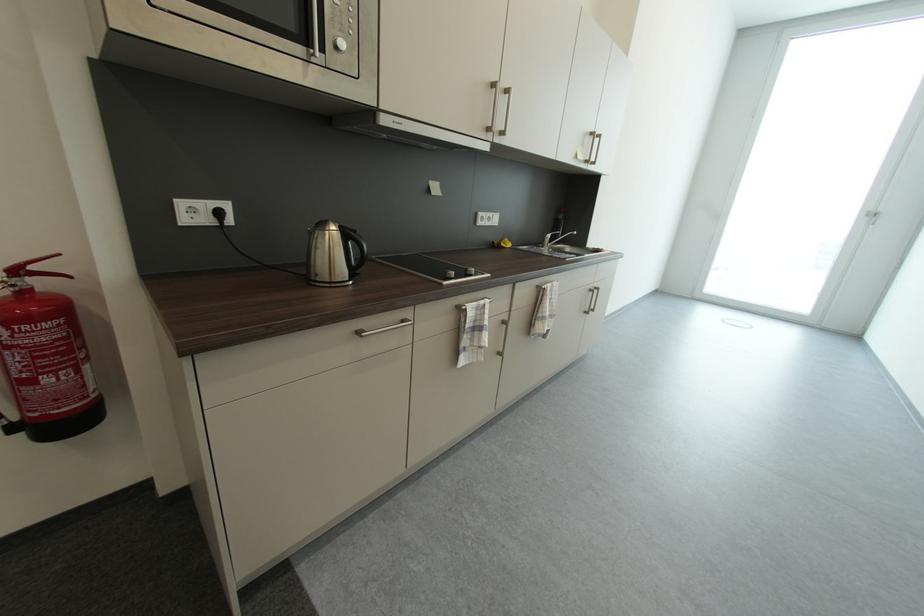
Where would you turn the white door handle? Please return your answer as a coordinate pair (x, y).

(872, 216)